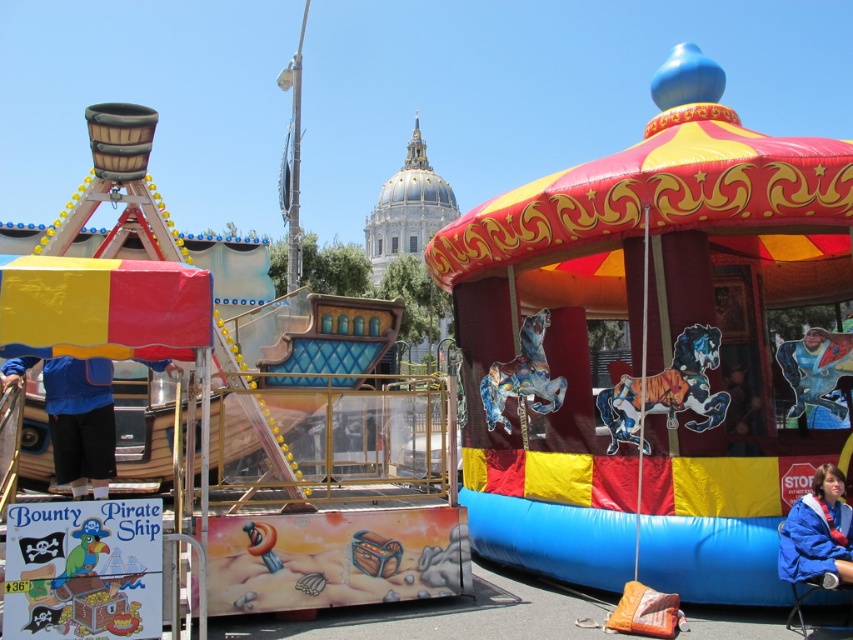
Question: Estimate the real-world distances between objects in this image. Which object is closer to the blue fabric jacket at left?

Choices:
 (A) blue fabric jacket at lower right
 (B) rubberized inflatable carousel at center

Answer: (B)

Question: Can you confirm if rubberized inflatable carousel at center is positioned to the right of blue fabric jacket at lower right?

Choices:
 (A) no
 (B) yes

Answer: (A)

Question: Is blue fabric jacket at left positioned at the back of blue fabric jacket at lower right?

Choices:
 (A) yes
 (B) no

Answer: (A)

Question: Which point is farther from the camera taking this photo?

Choices:
 (A) (73, 380)
 (B) (677, 307)
 (C) (827, 483)

Answer: (B)

Question: Which object is positioned farthest from the blue fabric jacket at left?

Choices:
 (A) rubberized inflatable carousel at center
 (B) blue fabric jacket at lower right

Answer: (B)

Question: Is rubberized inflatable carousel at center bigger than blue fabric jacket at left?

Choices:
 (A) no
 (B) yes

Answer: (B)